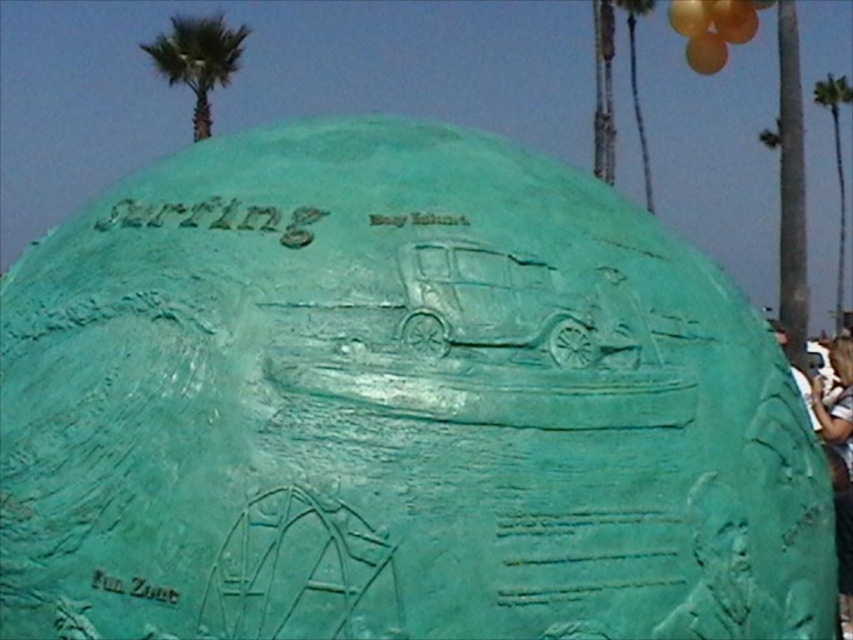
Is green bronze statue at center wider than orange matte balloons at upper right?

Yes, green bronze statue at center is wider than orange matte balloons at upper right.

Is green bronze statue at center taller than orange matte balloons at upper right?

Correct, green bronze statue at center is much taller as orange matte balloons at upper right.

Between point (833, 464) and point (724, 8), which one is positioned behind?

Positioned behind is point (724, 8).

This screenshot has width=853, height=640. I want to click on green bronze statue at center, so click(x=836, y=406).

Does green bronze statue at center have a greater width compared to green textured palm tree at right?

Yes.

Does green bronze statue at center have a smaller size compared to green textured palm tree at right?

No.

What do you see at coordinates (836, 406) in the screenshot?
I see `green bronze statue at center` at bounding box center [836, 406].

Identify the location of green bronze statue at center. The image size is (853, 640). (836, 406).

Between point (711, 52) and point (712, 60), which one is positioned behind?

Point (712, 60)

Is orange matte balloons at upper right below translucent orange balloon at upper right?

Actually, orange matte balloons at upper right is above translucent orange balloon at upper right.

Find the location of `orange matte balloons at upper right`. orange matte balloons at upper right is located at coordinates (712, 28).

Where is `orange matte balloons at upper right`? This screenshot has width=853, height=640. orange matte balloons at upper right is located at coordinates (712, 28).